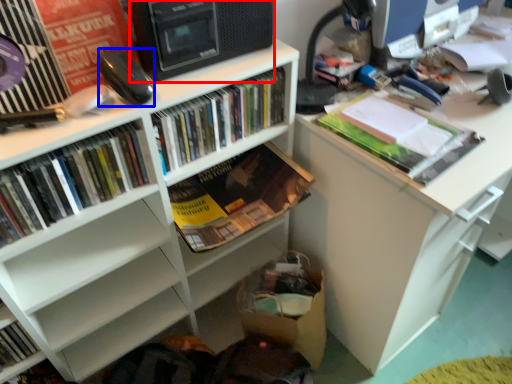
Question: Which object appears farthest to the camera in this image, computer tower (highlighted by a red box) or equipment (highlighted by a blue box)?

Choices:
 (A) computer tower
 (B) equipment

Answer: (B)